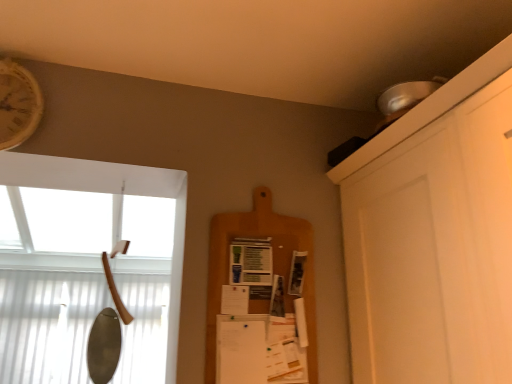
Question: Considering the relative positions of wooden clock at upper left and wooden axe handle at left in the image provided, is wooden clock at upper left to the left of wooden axe handle at left from the viewer's perspective?

Choices:
 (A) no
 (B) yes

Answer: (B)

Question: Would you consider wooden clock at upper left to be distant from wooden axe handle at left?

Choices:
 (A) no
 (B) yes

Answer: (B)

Question: Does wooden clock at upper left have a smaller size compared to wooden axe handle at left?

Choices:
 (A) no
 (B) yes

Answer: (B)

Question: From a real-world perspective, is wooden clock at upper left positioned over wooden axe handle at left based on gravity?

Choices:
 (A) no
 (B) yes

Answer: (B)

Question: Does wooden clock at upper left have a greater height compared to wooden axe handle at left?

Choices:
 (A) no
 (B) yes

Answer: (A)

Question: From the image's perspective, is wooden clock at upper left located above or below wooden axe handle at left?

Choices:
 (A) below
 (B) above

Answer: (B)

Question: In the image, is wooden clock at upper left positioned in front of or behind wooden axe handle at left?

Choices:
 (A) front
 (B) behind

Answer: (B)

Question: Visually, is wooden clock at upper left positioned to the left or to the right of wooden axe handle at left?

Choices:
 (A) left
 (B) right

Answer: (A)

Question: Is wooden clock at upper left wider or thinner than wooden axe handle at left?

Choices:
 (A) wide
 (B) thin

Answer: (B)

Question: Based on their positions, is wooden cutting board at center located to the left or right of wooden axe handle at left?

Choices:
 (A) left
 (B) right

Answer: (B)

Question: In terms of size, does wooden cutting board at center appear bigger or smaller than wooden axe handle at left?

Choices:
 (A) big
 (B) small

Answer: (B)

Question: In terms of height, does wooden cutting board at center look taller or shorter compared to wooden axe handle at left?

Choices:
 (A) short
 (B) tall

Answer: (A)

Question: Is wooden cutting board at center wider or thinner than wooden axe handle at left?

Choices:
 (A) wide
 (B) thin

Answer: (B)

Question: In terms of size, does wooden axe handle at left appear bigger or smaller than wooden clock at upper left?

Choices:
 (A) small
 (B) big

Answer: (B)

Question: From a real-world perspective, relative to wooden clock at upper left, is wooden axe handle at left vertically above or below?

Choices:
 (A) below
 (B) above

Answer: (A)